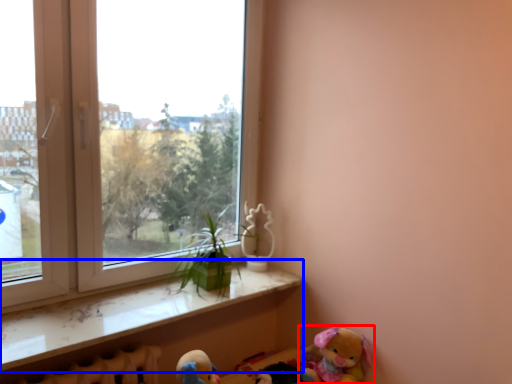
Question: Which point is further to the camera, toy (highlighted by a red box) or window sill (highlighted by a blue box)?

Choices:
 (A) toy
 (B) window sill

Answer: (A)